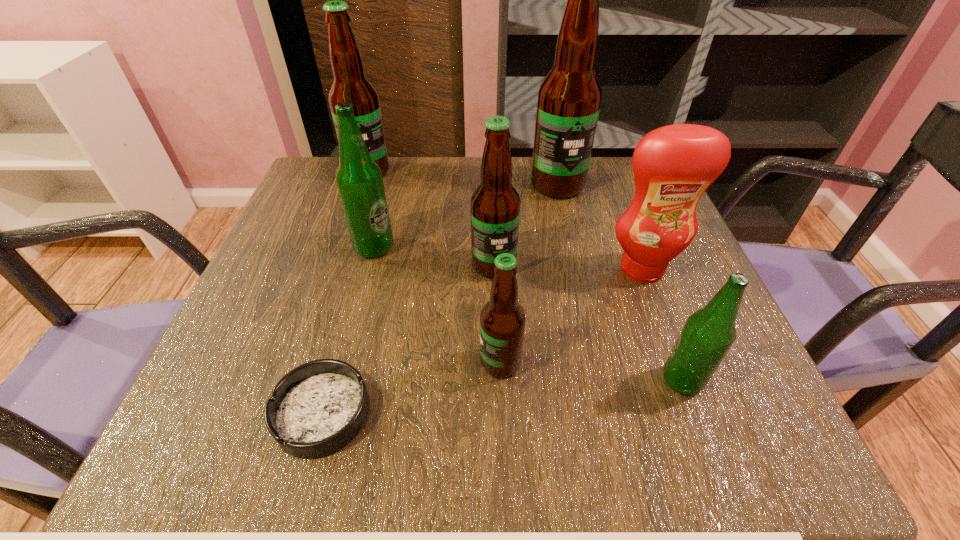
Identify the location of free space between the left green beer bottle and the third biggest brown beer bottle. 434,256.

Locate an element on the screen. The width and height of the screenshot is (960, 540). unoccupied area between the red condiment and the nearest brown beer bottle is located at coordinates [x=571, y=315].

Where is `vacant space that's between the biggest brown beer bottle and the shortest object`? The image size is (960, 540). vacant space that's between the biggest brown beer bottle and the shortest object is located at coordinates (440, 299).

Locate an element on the screen. vacant area between the rightmost beer bottle and the nearest brown beer bottle is located at coordinates (591, 372).

This screenshot has width=960, height=540. Find the location of `free point between the fifth beer bottle from left to right and the ashtray`. free point between the fifth beer bottle from left to right and the ashtray is located at coordinates (440, 299).

The image size is (960, 540). What are the coordinates of `vacant space that's between the ashtray and the nearer green beer bottle` in the screenshot? It's located at (502, 397).

At what (x,y) coordinates should I click in order to perform the action: click on vacant space in between the left green beer bottle and the dark ashtray. Please return your answer as a coordinate pair (x, y). Looking at the image, I should click on (348, 330).

Select which object is the closest to the condiment. Please provide its 2D coordinates. Your answer should be formatted as a tuple, i.e. [(x, y)], where the tuple contains the x and y coordinates of a point satisfying the conditions above.

[(495, 204)]

Identify the location of the fifth closest object to the red condiment. Image resolution: width=960 pixels, height=540 pixels. (359, 179).

Where is `the third closest beer bottle to the second tallest object`? the third closest beer bottle to the second tallest object is located at coordinates (569, 98).